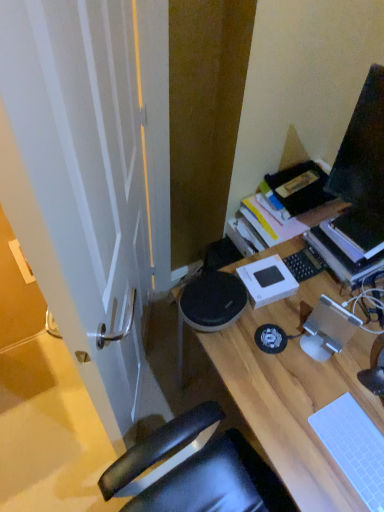
Find the location of a particular element. The height and width of the screenshot is (512, 384). free space above white matte laptop keyboard at lower right, which is the first laptop keyboard in front-to-back order (from a real-world perspective) is located at coordinates pyautogui.click(x=357, y=448).